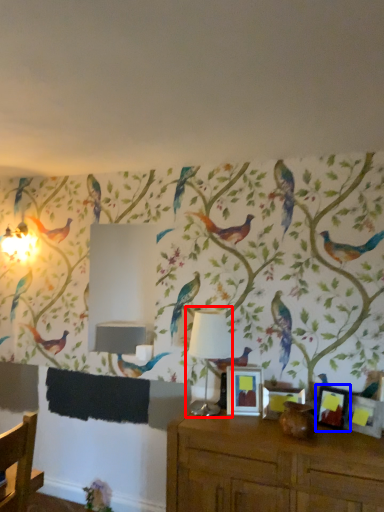
Question: Which of the following is the closest to the observer, table lamp (highlighted by a red box) or picture frame (highlighted by a blue box)?

Choices:
 (A) table lamp
 (B) picture frame

Answer: (B)